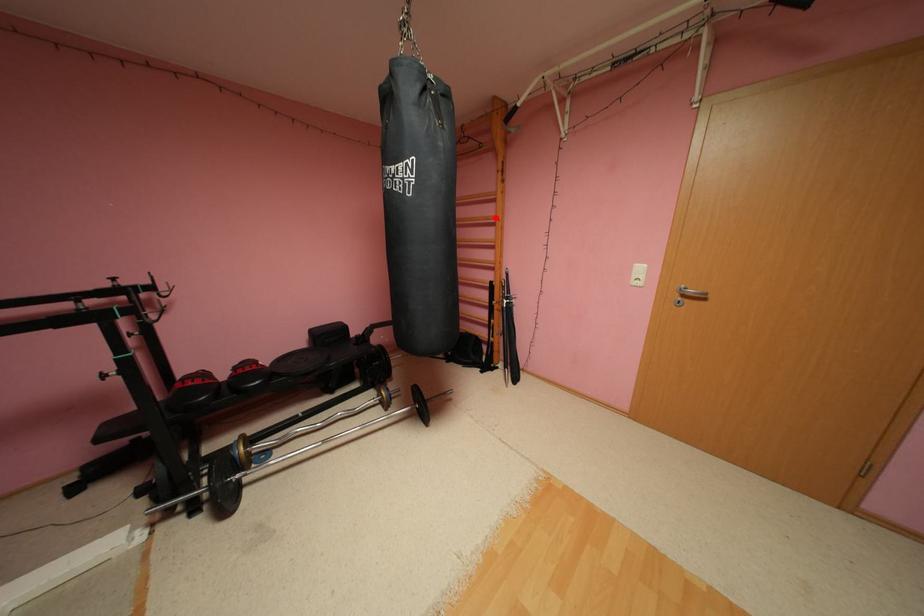
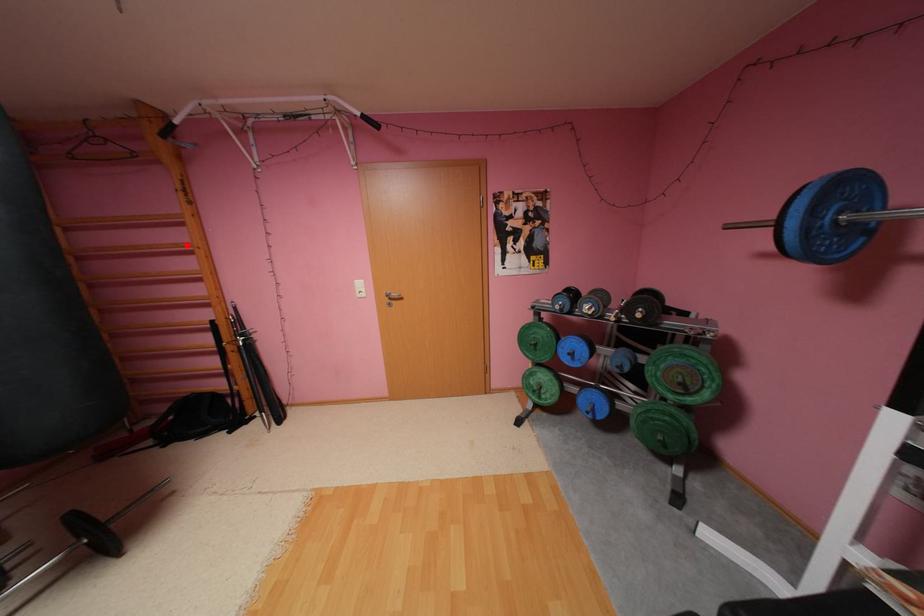
I am providing you with two images of the same scene from different viewpoints. A red point is marked on the first image and another point is marked on the second image. Does the point marked in image1 correspond to the same location as the one in image2?

Yes